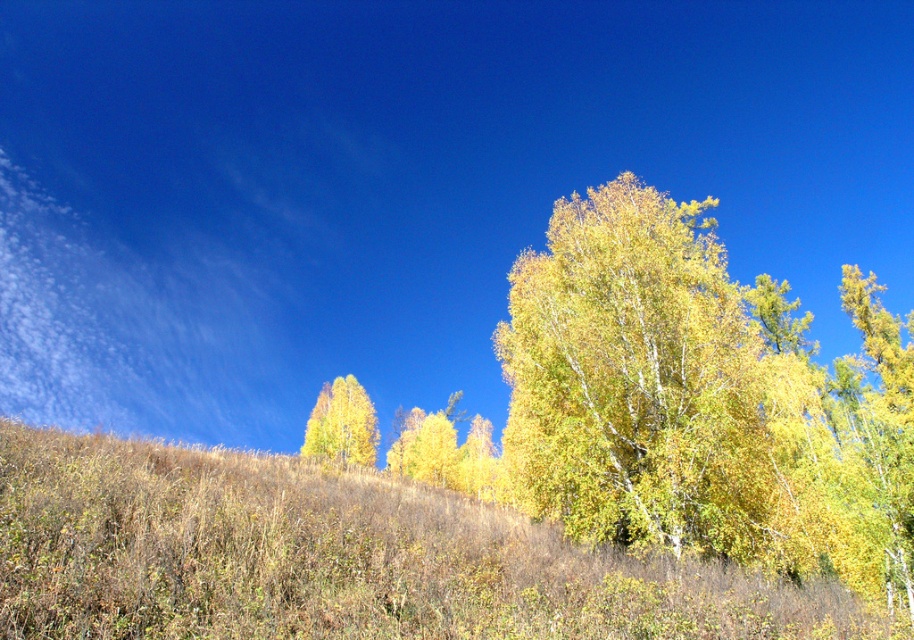
You are standing on the grassy hillside in the autumn landscape and see two points marked on the ground. The first point is at coordinate point (572, 490) and the second is at point (319, 442). Which point is closer to you?

Point (572, 490) is in front of point (319, 442), so it is closer to you.